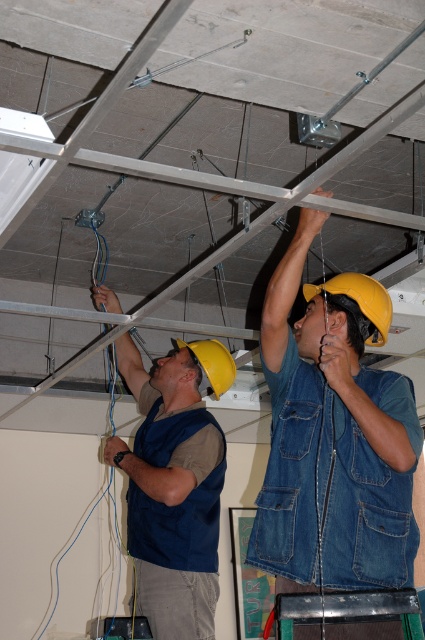
You are a safety inspector observing the construction site. You notice two items of safety equipment in the scene. The first is a denim vest at upper center, and the second is a yellow matte helmet at center. According to safety regulations, the helmet must be worn above the vest. Does the current arrangement comply with the regulation?

The denim vest at upper center is taller than the yellow matte helmet at center, which means the helmet is positioned below the vest. This does not comply with the safety regulation requiring the helmet to be worn above the vest.

You are a safety inspector checking the equipment of two construction workers. You notice the yellow hard hat at upper center and the yellow matte helmet at center. Which one is bigger in size?

The yellow hard hat at upper center has a larger size compared to the yellow matte helmet at center.

You are a safety inspector checking the equipment of two workers. You notice the yellow hard hat at upper center and the yellow matte helmet at center. Which one is shorter in height?

The yellow hard hat at upper center is shorter than the yellow matte helmet at center.